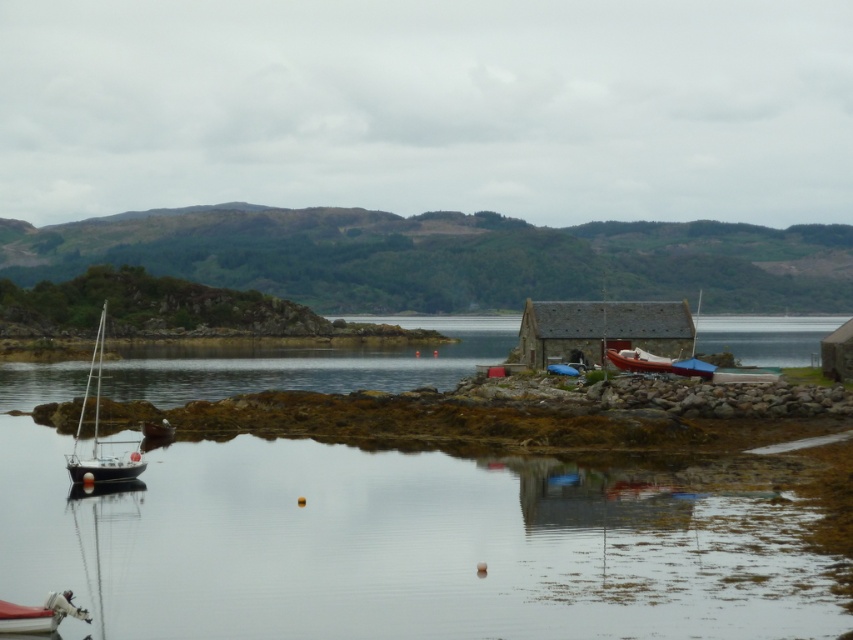
Can you confirm if clear water at lower left is shorter than wooden boat at right?

No, clear water at lower left is not shorter than wooden boat at right.

Image resolution: width=853 pixels, height=640 pixels. Describe the element at coordinates (401, 547) in the screenshot. I see `clear water at lower left` at that location.

Between point (48, 493) and point (608, 353), which one is positioned behind?

Positioned behind is point (608, 353).

The image size is (853, 640). Identify the location of clear water at lower left. (401, 547).

Does clear water at lower left have a lesser height compared to white glossy sailboat at left?

Correct, clear water at lower left is not as tall as white glossy sailboat at left.

Where is `clear water at lower left`? This screenshot has height=640, width=853. clear water at lower left is located at coordinates (401, 547).

Is point (123, 611) in front of point (94, 468)?

Yes.

At what (x,y) coordinates should I click in order to perform the action: click on clear water at lower left. Please return your answer as a coordinate pair (x, y). This screenshot has width=853, height=640. Looking at the image, I should click on (401, 547).

Measure the distance between point (85, 490) and camera.

A distance of 130.23 feet exists between point (85, 490) and camera.

Does white glossy sailboat at left lie behind white plastic boat at lower left?

Yes, white glossy sailboat at left is behind white plastic boat at lower left.

Which is behind, point (74, 448) or point (15, 621)?

Point (74, 448)

The width and height of the screenshot is (853, 640). Find the location of `white glossy sailboat at left`. white glossy sailboat at left is located at coordinates (97, 435).